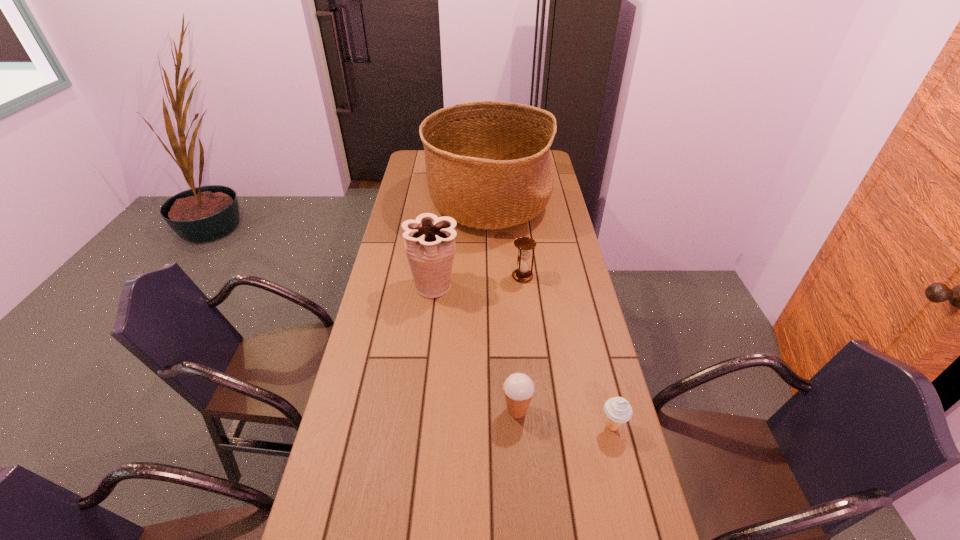
Image resolution: width=960 pixels, height=540 pixels. Identify the location of free space located on the back of the right icecream. (593, 349).

The width and height of the screenshot is (960, 540). I want to click on basket that is at the left edge, so (x=488, y=165).

The height and width of the screenshot is (540, 960). I want to click on urn that is at the left edge, so click(x=429, y=241).

Locate an element on the screen. This screenshot has height=540, width=960. basket that is positioned at the right edge is located at coordinates (488, 165).

In order to click on icecream at the right edge in this screenshot , I will do `click(618, 410)`.

This screenshot has width=960, height=540. In the image, there is a desktop. Identify the location of vacant space at the left edge. (308, 523).

Locate an element on the screen. vacant space at the right edge is located at coordinates (603, 456).

Locate an element on the screen. vacant area at the far left corner is located at coordinates (426, 171).

Image resolution: width=960 pixels, height=540 pixels. Identify the location of free space that is in between the urn and the left icecream. (475, 348).

I want to click on empty space that is in between the farthest object and the left icecream, so click(x=502, y=307).